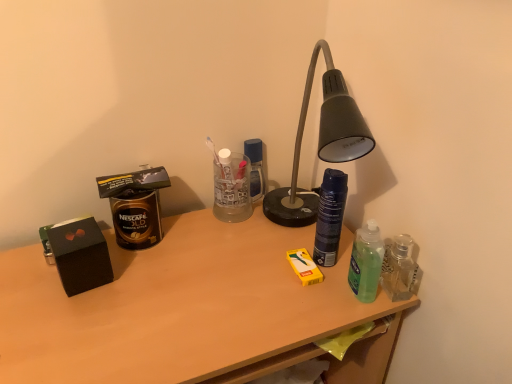
Where is `free area in between dark blue matte spray can at center, positioned as the 1th bottle in left-to-right order, and gold matte canister at left`? free area in between dark blue matte spray can at center, positioned as the 1th bottle in left-to-right order, and gold matte canister at left is located at coordinates (223, 247).